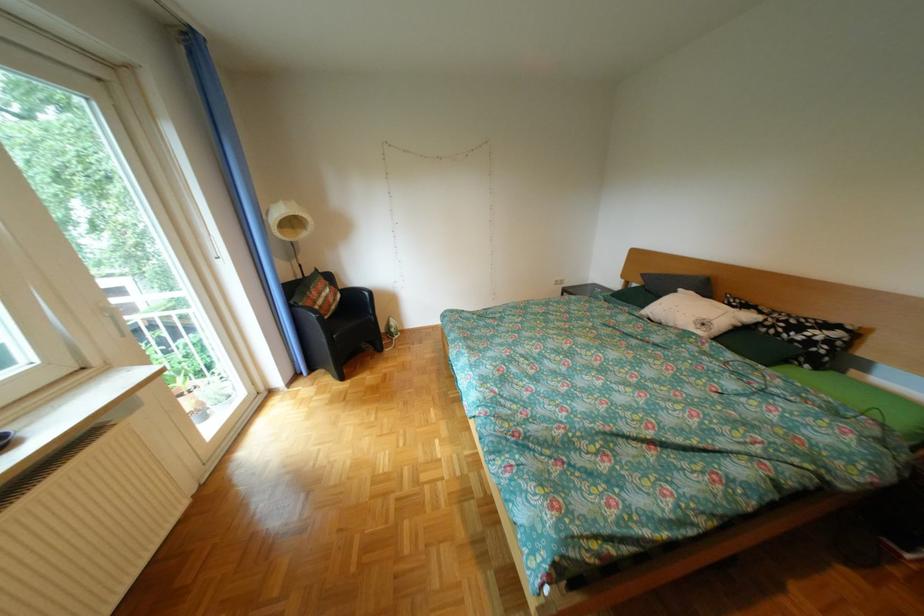
This screenshot has width=924, height=616. What do you see at coordinates (350, 329) in the screenshot? I see `the black chair sitting surface` at bounding box center [350, 329].